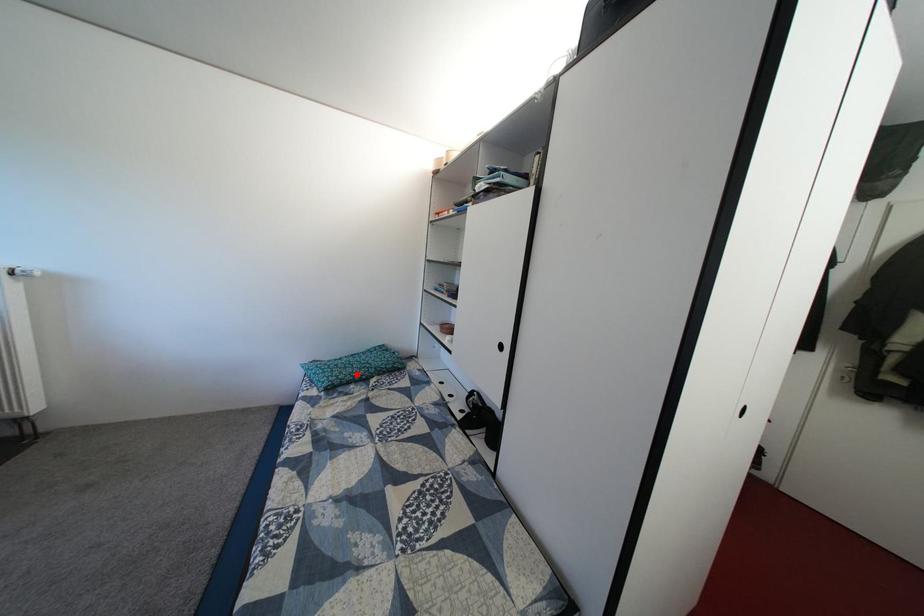
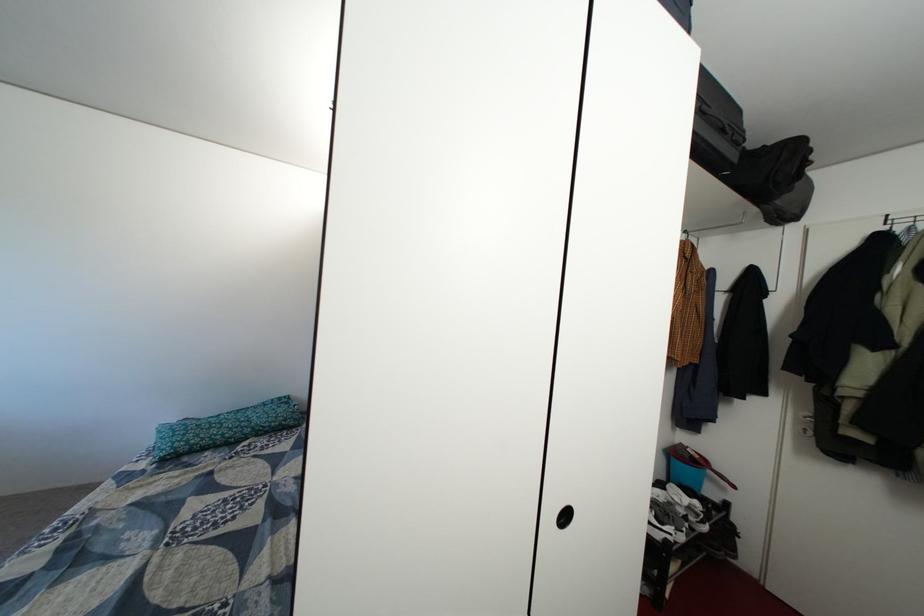
Locate, in the second image, the point that corresponds to the highlighted location in the first image.

(222, 435)